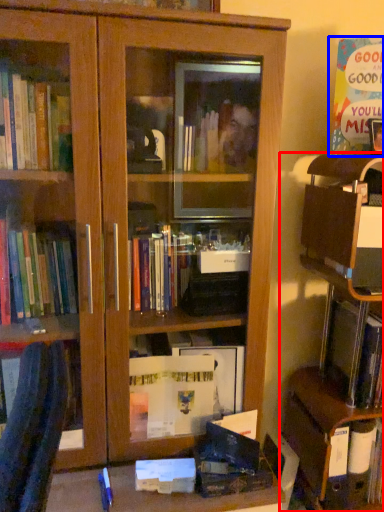
Question: Which of the following is the closest to the observer, shelf (highlighted by a red box) or paperback book (highlighted by a blue box)?

Choices:
 (A) shelf
 (B) paperback book

Answer: (A)